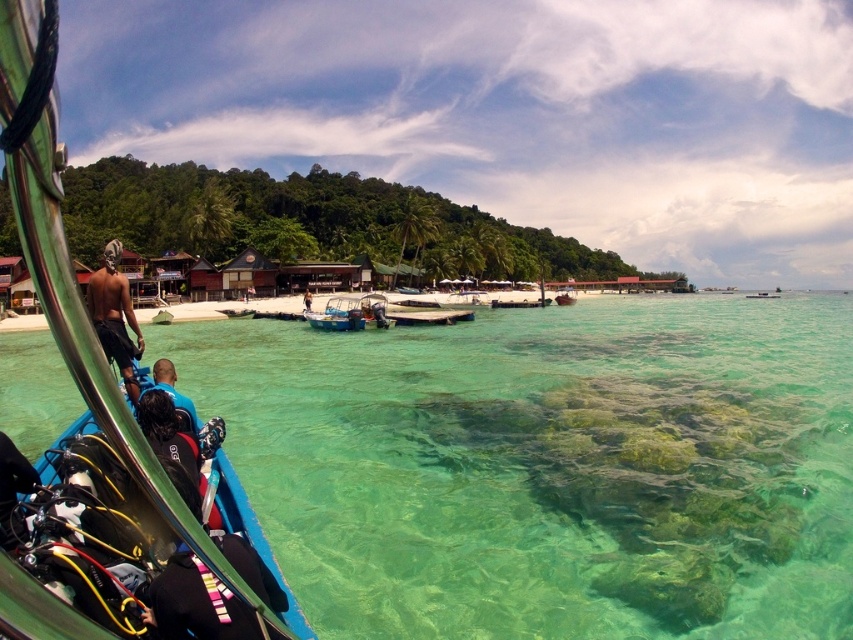
Question: Among these objects, which one is nearest to the camera?

Choices:
 (A) blue plastic boat at left
 (B) blue fabric shirt at center
 (C) clear water at lower center
 (D) wooden boat at center

Answer: (A)

Question: Among these points, which one is farthest from the camera?

Choices:
 (A) (305, 300)
 (B) (155, 376)

Answer: (A)

Question: Does shiny black shorts at left appear on the left side of blue plastic boat at center?

Choices:
 (A) yes
 (B) no

Answer: (B)

Question: Can you confirm if blue plastic boat at center is thinner than wooden boat at center?

Choices:
 (A) no
 (B) yes

Answer: (B)

Question: Which point appears closest to the camera in this image?

Choices:
 (A) (170, 388)
 (B) (122, 376)
 (C) (563, 300)

Answer: (A)

Question: From the image, what is the correct spatial relationship of clear water at lower center in relation to shiny black shorts at left?

Choices:
 (A) below
 (B) above

Answer: (A)